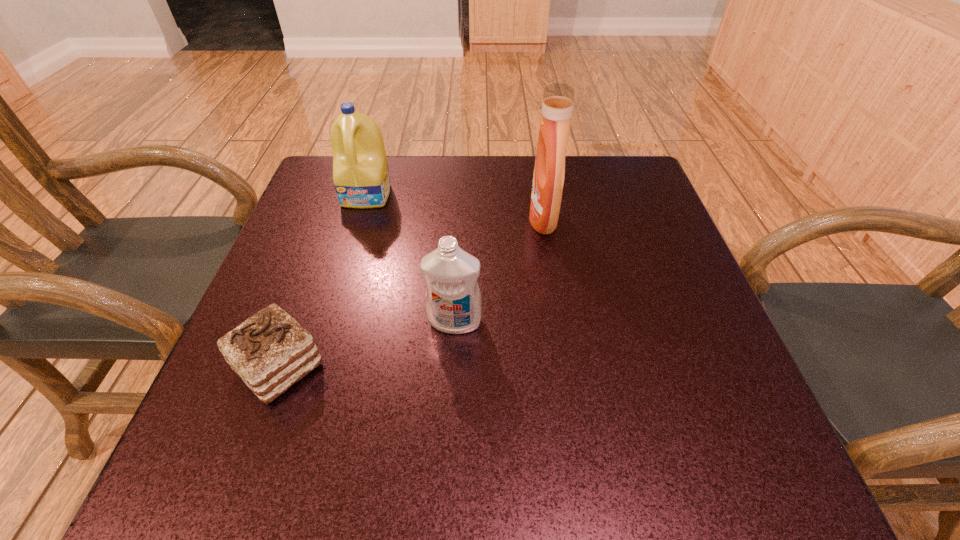
Where is `free area in between the leftmost detergent and the tallest detergent`? The height and width of the screenshot is (540, 960). free area in between the leftmost detergent and the tallest detergent is located at coordinates (455, 207).

Locate which object is the third closest to the tallest detergent. Please provide its 2D coordinates. Your answer should be formatted as a tuple, i.e. [(x, y)], where the tuple contains the x and y coordinates of a point satisfying the conditions above.

[(270, 351)]

Locate an element on the screen. Image resolution: width=960 pixels, height=540 pixels. object identified as the third closest to the second detergent from right to left is located at coordinates (361, 177).

In order to click on the second closest detergent to the rightmost object in this screenshot , I will do `click(361, 177)`.

Point out which detergent is positioned as the nearest to the leftmost detergent. Please provide its 2D coordinates. Your answer should be formatted as a tuple, i.e. [(x, y)], where the tuple contains the x and y coordinates of a point satisfying the conditions above.

[(453, 303)]

Image resolution: width=960 pixels, height=540 pixels. I want to click on free space that satisfies the following two spatial constraints: 1. on the label of the leftmost detergent; 2. on the right side of the second detergent from right to left, so click(x=329, y=322).

Where is `blank area in the image that satisfies the following two spatial constraints: 1. on the label of the second object from right to left; 2. on the left side of the leftmost detergent`? blank area in the image that satisfies the following two spatial constraints: 1. on the label of the second object from right to left; 2. on the left side of the leftmost detergent is located at coordinates (329, 322).